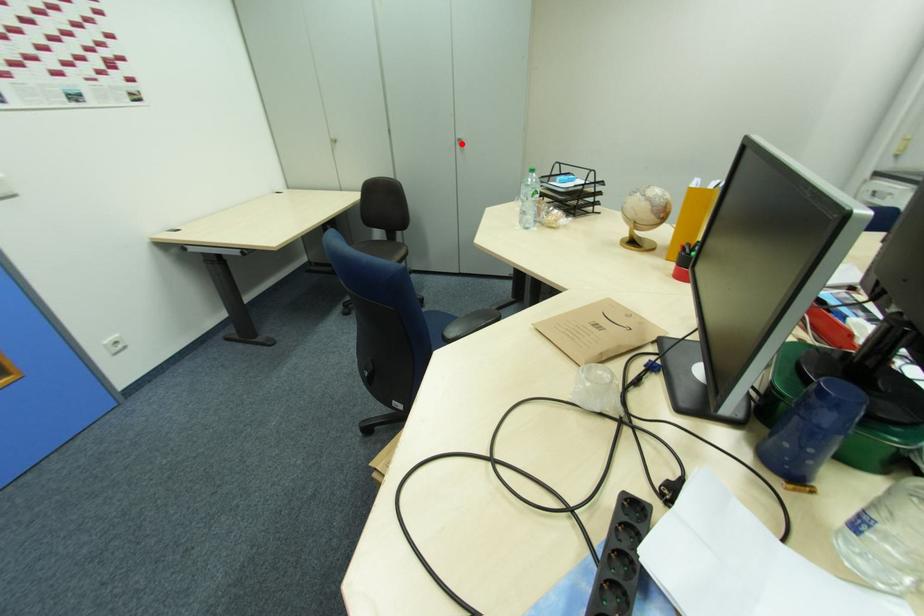
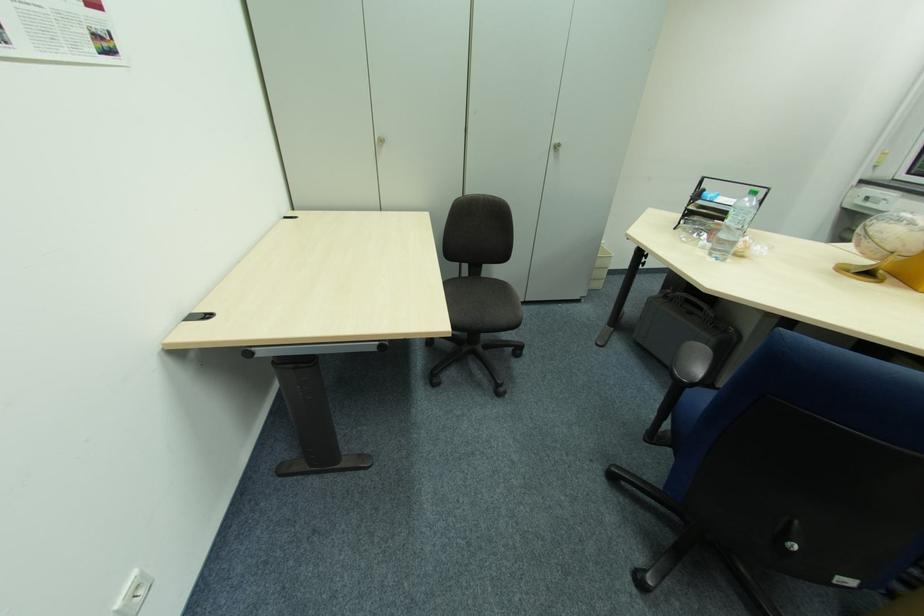
Find the pixel in the second image that matches the highlighted location in the first image.

(554, 150)